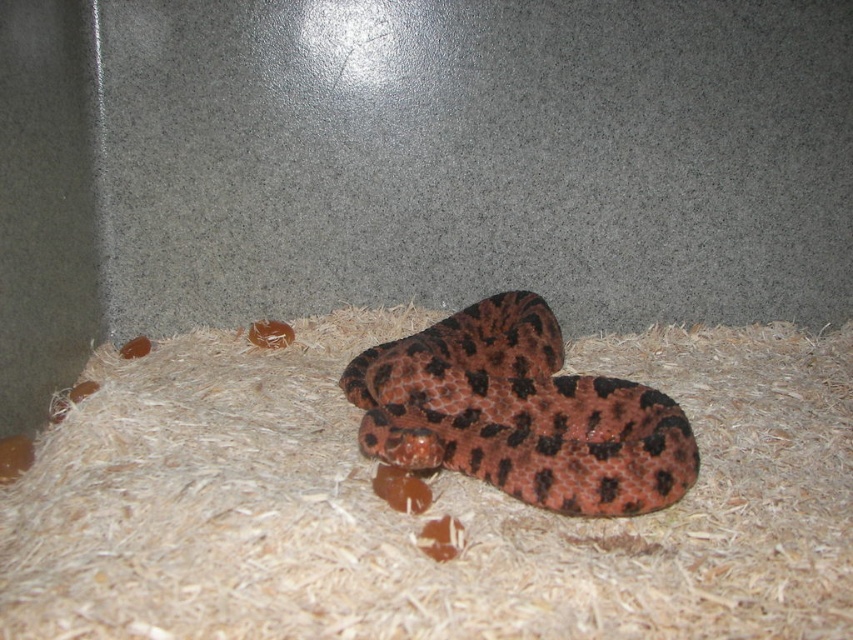
Question: Can you confirm if brown shredded hay at center is positioned to the left of leopard print snake at center?

Choices:
 (A) yes
 (B) no

Answer: (B)

Question: Where is brown shredded hay at center located in relation to leopard print snake at center in the image?

Choices:
 (A) left
 (B) right

Answer: (B)

Question: Which point appears farthest from the camera in this image?

Choices:
 (A) (345, 582)
 (B) (447, 417)

Answer: (B)

Question: Can you confirm if brown shredded hay at center is positioned above leopard print snake at center?

Choices:
 (A) no
 (B) yes

Answer: (A)